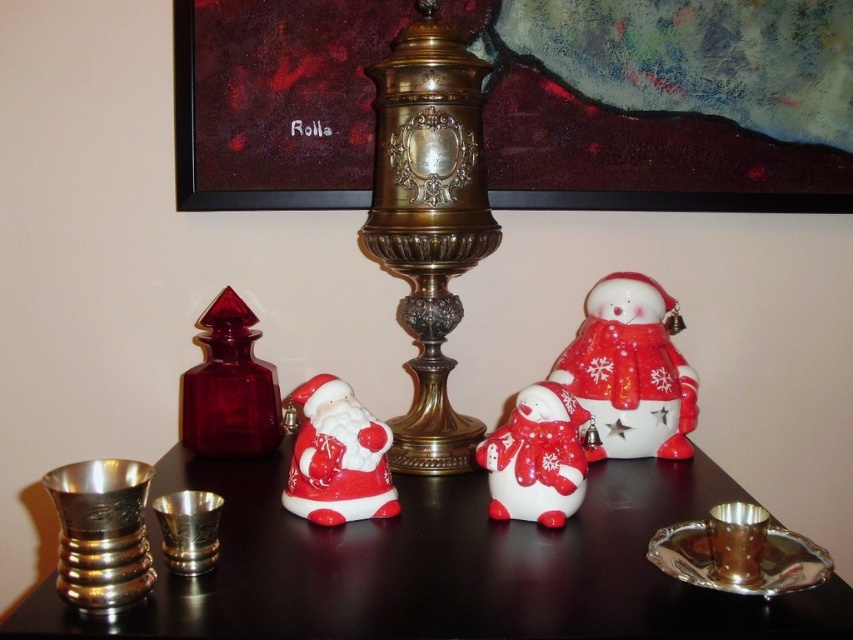
You are arranging flowers for a centerpiece and need to choose between the brushed metal candle holder at left and the ruby glass bottle at left. Which object has a smaller diameter to fit into a narrow vase holder?

The brushed metal candle holder at left is thinner than the ruby glass bottle at left, so it has a smaller diameter and would fit better into a narrow vase holder.

You are arranging items on a table and need to place a new object between the metallic gold picture frame at upper center and the brushed metal cups at left. Based on their positions, where should you place the new object?

The metallic gold picture frame at upper center is to the right of the brushed metal cups at left, so you should place the new object between them on the table, positioning it to the right of the brushed metal cups at left and to the left of the metallic gold picture frame at upper center.

You are standing in front of a decorative table arrangement. There are two points marked on the table surface at coordinates point (x=192, y=33) and point (x=381, y=589). If you want to place a small decoration closer to you, which point should you choose?

Point (x=192, y=33) is further to the camera than point (x=381, y=589), so placing the decoration at point (x=192, y=33) would be closer to you.